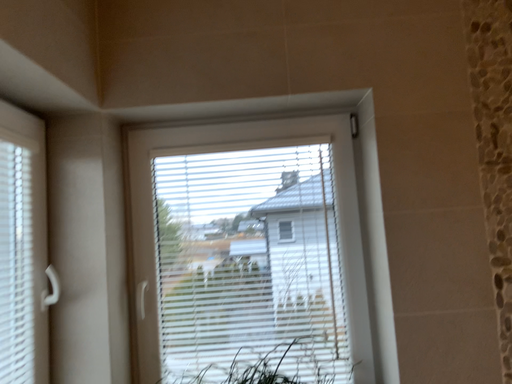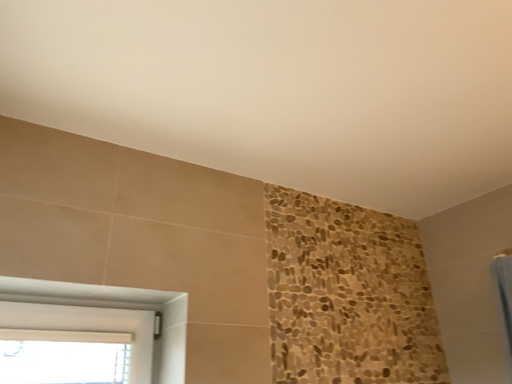
Question: Which way did the camera rotate in the video?

Choices:
 (A) rotated left
 (B) rotated right

Answer: (B)